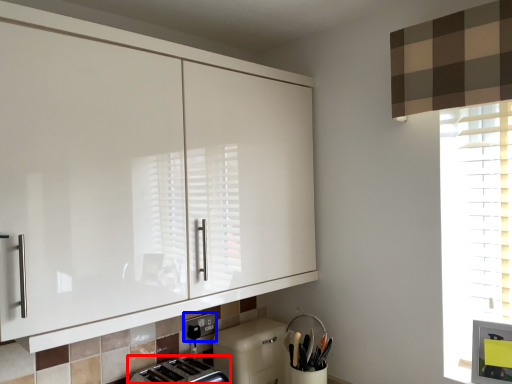
Question: Which object appears farthest to the camera in this image, toaster (highlighted by a red box) or electric outlet (highlighted by a blue box)?

Choices:
 (A) toaster
 (B) electric outlet

Answer: (B)